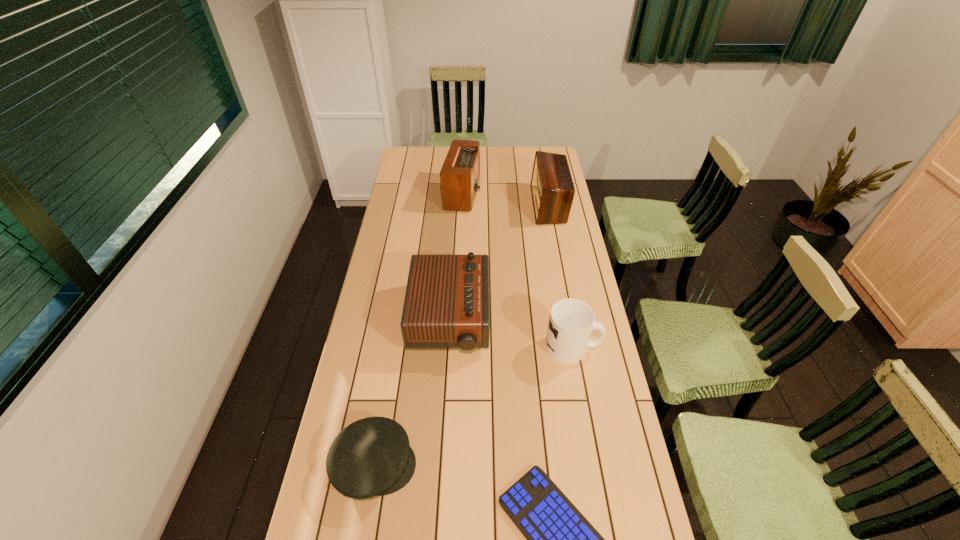
The height and width of the screenshot is (540, 960). I want to click on radio receiver that is positioned at the right edge, so click(x=552, y=188).

Locate an element on the screen. The height and width of the screenshot is (540, 960). mug that is at the right edge is located at coordinates (571, 322).

Locate an element on the screen. This screenshot has width=960, height=540. vacant space at the far edge is located at coordinates (488, 163).

Find the location of a particular element. The height and width of the screenshot is (540, 960). free space at the left edge of the desktop is located at coordinates (408, 252).

In the image, there is a desktop. Identify the location of vacant space at the right edge. (596, 371).

In the image, there is a desktop. Where is `vacant space at the far left corner`? vacant space at the far left corner is located at coordinates (416, 158).

You are a GUI agent. You are given a task and a screenshot of the screen. Output one action in this format:
    pyautogui.click(x=<x>, y=<y>)
    Task: Click on the vacant area that lies between the mug and the beret
    The height and width of the screenshot is (540, 960).
    Given the screenshot: What is the action you would take?
    pyautogui.click(x=473, y=407)

Where is `vacant area that lies between the beret and the nearest radio receiver`? vacant area that lies between the beret and the nearest radio receiver is located at coordinates (412, 393).

Locate an element on the screen. Image resolution: width=960 pixels, height=540 pixels. vacant space that's between the nearest radio receiver and the beret is located at coordinates (412, 393).

At what (x,y) coordinates should I click in order to perform the action: click on vacant area that lies between the mug and the rightmost radio receiver. Please return your answer as a coordinate pair (x, y). This screenshot has height=540, width=960. Looking at the image, I should click on (561, 276).